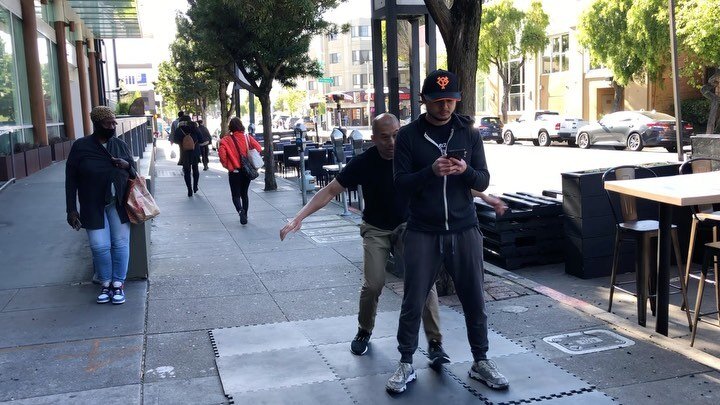
Locate an element on the screen. Image resolution: width=720 pixels, height=405 pixels. table is located at coordinates (680, 195).